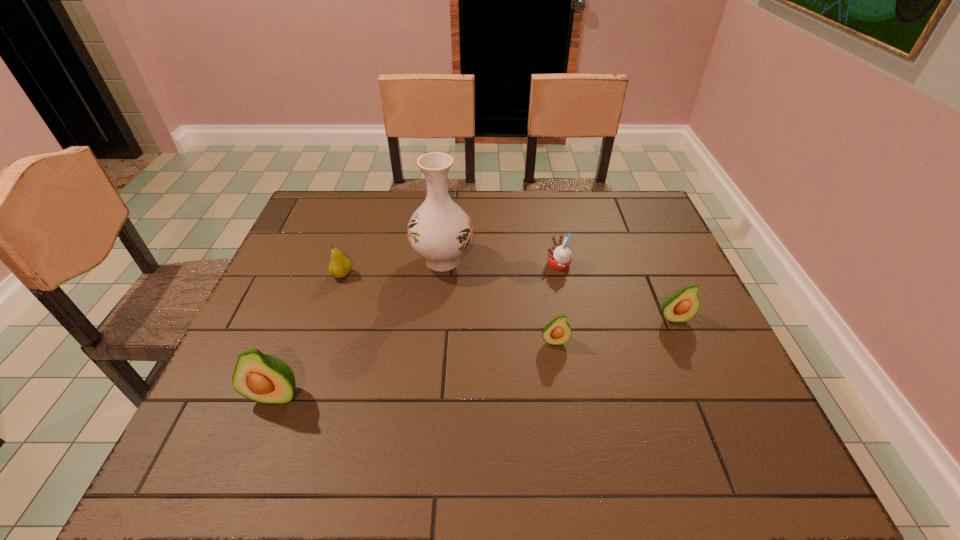
Identify the location of vacant space that's between the nearest object and the fifth farthest object. The height and width of the screenshot is (540, 960). (415, 368).

I want to click on unoccupied position between the muffin and the third object from left to right, so click(x=500, y=262).

At what (x,y) coordinates should I click in order to perform the action: click on vacant area that lies between the second tallest object and the rightmost object. Please return your answer as a coordinate pair (x, y). The height and width of the screenshot is (540, 960). Looking at the image, I should click on (474, 356).

The image size is (960, 540). What are the coordinates of `empty location between the leftmost avocado and the rightmost avocado` in the screenshot? It's located at pos(474,356).

Locate an element on the screen. The width and height of the screenshot is (960, 540). empty space between the tallest object and the nearest avocado is located at coordinates (359, 328).

This screenshot has width=960, height=540. I want to click on blank region between the fifth shortest object and the tallest object, so click(359, 328).

In order to click on vacant area that lies between the shortest avocado and the muffin in this screenshot , I will do `click(557, 303)`.

In order to click on vacant area between the muffin and the tallest object in this screenshot , I will do `click(500, 262)`.

Where is `object that is the second closest to the second nearest object`? Image resolution: width=960 pixels, height=540 pixels. object that is the second closest to the second nearest object is located at coordinates (681, 306).

I want to click on object that stands as the fourth closest to the second tallest object, so click(x=559, y=255).